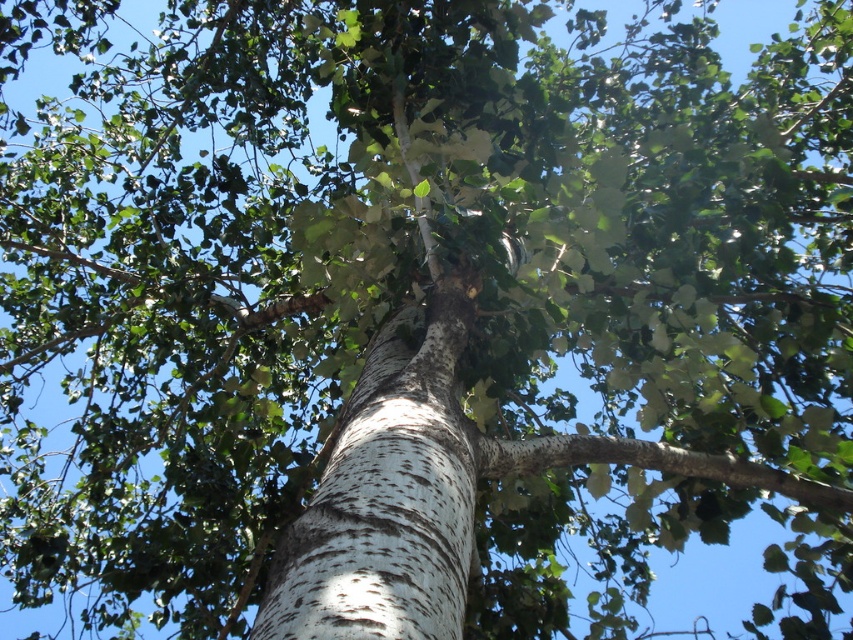
Question: Can you confirm if white speckled bark at center is thinner than white rough bark branch at center?

Choices:
 (A) yes
 (B) no

Answer: (A)

Question: Which point is closer to the camera?

Choices:
 (A) (380, 532)
 (B) (529, 438)

Answer: (A)

Question: Which point is closer to the camera?

Choices:
 (A) white rough bark branch at center
 (B) white speckled bark at center

Answer: (B)

Question: Is white speckled bark at center above white rough bark branch at center?

Choices:
 (A) yes
 (B) no

Answer: (A)

Question: Observing the image, what is the correct spatial positioning of white speckled bark at center in reference to white rough bark branch at center?

Choices:
 (A) below
 (B) above

Answer: (B)